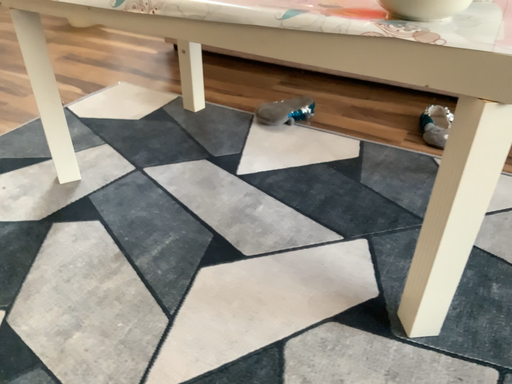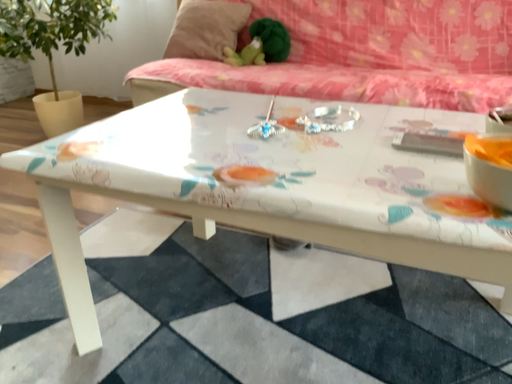
Question: How did the camera likely rotate when shooting the video?

Choices:
 (A) rotated upward
 (B) rotated downward

Answer: (A)